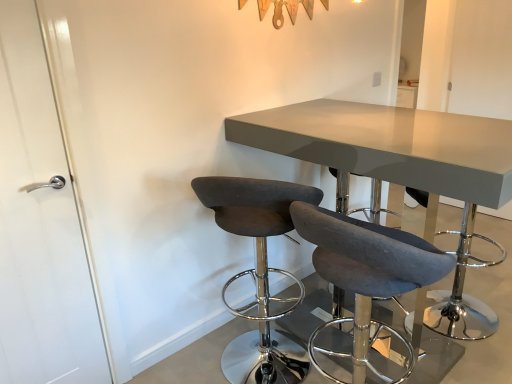
Question: From a real-world perspective, is gray fabric bar stool at center physically located above or below matte gray table at center?

Choices:
 (A) above
 (B) below

Answer: (B)

Question: Considering the positions of gray fabric bar stool at center and matte gray table at center in the image, is gray fabric bar stool at center taller or shorter than matte gray table at center?

Choices:
 (A) short
 (B) tall

Answer: (A)

Question: Which of these objects is positioned farthest from the dark gray fabric stool at center, the first chair positioned from the left?

Choices:
 (A) gray fabric bar stool at center
 (B) white glossy door at left
 (C) dark gray fabric stool at center, the 2th chair from the left
 (D) matte gray table at center

Answer: (A)

Question: Estimate the real-world distances between objects in this image. Which object is farther from the gray fabric bar stool at center?

Choices:
 (A) matte gray table at center
 (B) dark gray fabric stool at center, the second chair viewed from the right
 (C) white glossy door at left
 (D) dark gray fabric stool at center, the first chair viewed from the right

Answer: (C)